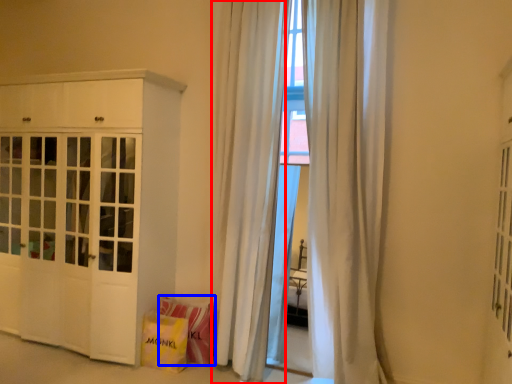
Question: Which object is further to the camera taking this photo, curtain (highlighted by a red box) or shopping bag (highlighted by a blue box)?

Choices:
 (A) curtain
 (B) shopping bag

Answer: (B)